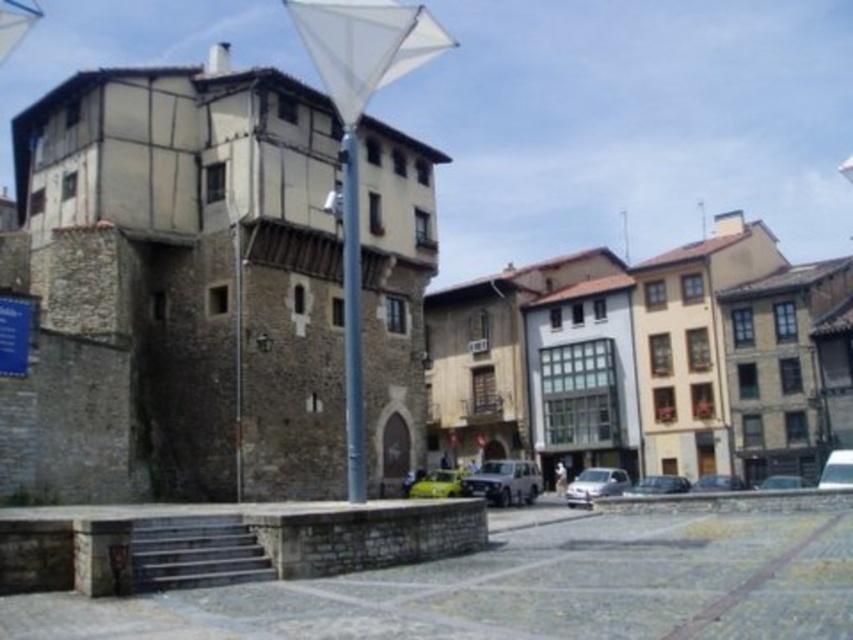
Is silver metallic car at center taller than shiny black car at center?

Yes.

Does silver metallic car at center appear on the right side of shiny black car at center?

In fact, silver metallic car at center is to the left of shiny black car at center.

Between point (606, 476) and point (730, 486), which one is positioned behind?

Positioned behind is point (730, 486).

Identify the location of silver metallic car at center. Image resolution: width=853 pixels, height=640 pixels. (595, 484).

Is blue glossy pole at center positioned before metallic silver suv at center?

Yes, it is in front of metallic silver suv at center.

How distant is blue glossy pole at center from metallic silver suv at center?

blue glossy pole at center is 22.38 meters from metallic silver suv at center.

Between point (355, 456) and point (500, 465), which one is positioned behind?

Positioned behind is point (500, 465).

Find the location of a particular element. blue glossy pole at center is located at coordinates (351, 316).

Is point (352, 189) more distant than point (679, 481)?

That is False.

Which of these two, blue glossy pole at center or shiny silver car at lower center, stands taller?

Standing taller between the two is blue glossy pole at center.

Which is behind, point (345, 349) or point (657, 477)?

The point (657, 477) is more distant.

This screenshot has height=640, width=853. I want to click on blue glossy pole at center, so pos(351,316).